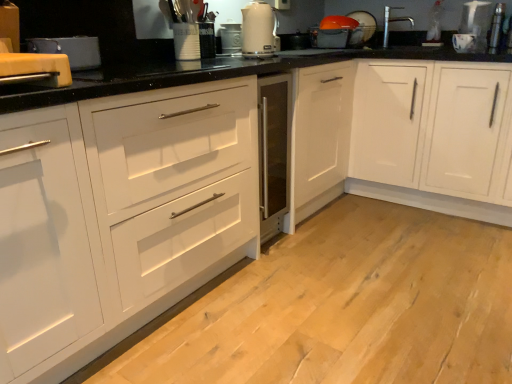
Question: Is white matte cabinet at center, the second cabinetry from the right, far away from metallic silver toaster at upper right, which appears as the first appliance when viewed from the right?

Choices:
 (A) no
 (B) yes

Answer: (B)

Question: Can you confirm if white matte cabinet at center, the second cabinetry from the right, is smaller than metallic silver toaster at upper right, which is counted as the fourth appliance, starting from the left?

Choices:
 (A) yes
 (B) no

Answer: (B)

Question: Is white matte cabinet at center, the second cabinetry from the right, behind metallic silver toaster at upper right, the 3th appliance in the front-to-back sequence?

Choices:
 (A) yes
 (B) no

Answer: (B)

Question: Does white matte cabinet at center, the second cabinetry from the right, appear on the right side of metallic silver toaster at upper right, placed as the third appliance when sorted from bottom to top?

Choices:
 (A) no
 (B) yes

Answer: (A)

Question: Can you confirm if white matte cabinet at center, the second cabinetry from the right, is positioned to the left of metallic silver toaster at upper right, arranged as the 2th appliance when viewed from the top?

Choices:
 (A) yes
 (B) no

Answer: (A)

Question: Looking at the image, does matte black toaster at upper left, placed as the fourth appliance when sorted from right to left, seem bigger or smaller compared to matte white dish drainer at upper right, which appears as the 4th appliance when viewed from the front?

Choices:
 (A) small
 (B) big

Answer: (B)

Question: From a real-world perspective, is matte black toaster at upper left, positioned as the 4th appliance in back-to-front order, physically located above or below matte white dish drainer at upper right, which appears as the 4th appliance when viewed from the front?

Choices:
 (A) above
 (B) below

Answer: (B)

Question: In terms of width, does matte black toaster at upper left, positioned as the 4th appliance in back-to-front order, look wider or thinner when compared to matte white dish drainer at upper right, placed as the 1th appliance when sorted from top to bottom?

Choices:
 (A) thin
 (B) wide

Answer: (B)

Question: From the image's perspective, is matte black toaster at upper left, which appears as the 1th appliance when viewed from the front, positioned above or below matte white dish drainer at upper right, the third appliance from the left?

Choices:
 (A) below
 (B) above

Answer: (A)

Question: Is silver metallic faucet at upper right situated inside matte white dish drainer at upper right, which appears as the 4th appliance when viewed from the front, or outside?

Choices:
 (A) outside
 (B) inside

Answer: (A)

Question: In the image, is silver metallic faucet at upper right positioned in front of or behind matte white dish drainer at upper right, which appears as the fourth appliance when ordered from the bottom?

Choices:
 (A) front
 (B) behind

Answer: (A)

Question: From a real-world perspective, is silver metallic faucet at upper right physically located above or below matte white dish drainer at upper right, which appears as the fourth appliance when ordered from the bottom?

Choices:
 (A) above
 (B) below

Answer: (A)

Question: Considering the positions of silver metallic faucet at upper right and matte white dish drainer at upper right, which is the 1th appliance in back-to-front order, in the image, is silver metallic faucet at upper right wider or thinner than matte white dish drainer at upper right, which is the 1th appliance in back-to-front order,?

Choices:
 (A) thin
 (B) wide

Answer: (B)

Question: In terms of size, does white glossy electric kettle at upper center appear bigger or smaller than metallic silver toaster at center, the 2th appliance viewed from the front?

Choices:
 (A) small
 (B) big

Answer: (B)

Question: Do you think white glossy electric kettle at upper center is within metallic silver toaster at center, which is the 2th appliance in left-to-right order, or outside of it?

Choices:
 (A) outside
 (B) inside

Answer: (A)